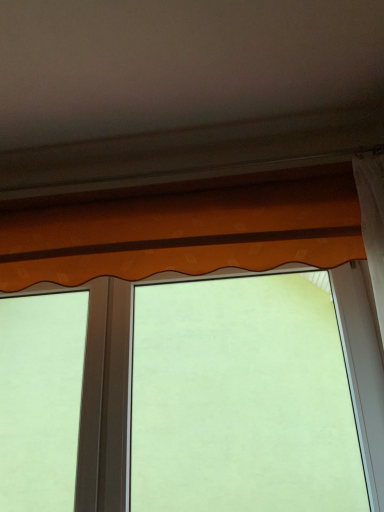
Where is `orange fabric valance at center`? The width and height of the screenshot is (384, 512). orange fabric valance at center is located at coordinates (106, 399).

Image resolution: width=384 pixels, height=512 pixels. What do you see at coordinates (106, 399) in the screenshot?
I see `orange fabric valance at center` at bounding box center [106, 399].

Where is `orange fabric curtain at upper center`? The image size is (384, 512). orange fabric curtain at upper center is located at coordinates (185, 232).

This screenshot has height=512, width=384. Describe the element at coordinates (185, 232) in the screenshot. I see `orange fabric curtain at upper center` at that location.

Find the location of `orange fabric valance at center`. orange fabric valance at center is located at coordinates (106, 399).

Considering the positions of objects orange fabric curtain at upper center and orange fabric valance at center in the image provided, who is more to the left, orange fabric curtain at upper center or orange fabric valance at center?

orange fabric valance at center is more to the left.

Is orange fabric curtain at upper center positioned in front of orange fabric valance at center?

Yes, the depth of orange fabric curtain at upper center is less than that of orange fabric valance at center.

Which is in front, point (184, 271) or point (365, 437)?

Point (184, 271)

From the image's perspective, is orange fabric curtain at upper center above or below orange fabric valance at center?

Based on their image positions, orange fabric curtain at upper center is located above orange fabric valance at center.

From a real-world perspective, is orange fabric curtain at upper center positioned above or below orange fabric valance at center?

orange fabric curtain at upper center is above orange fabric valance at center.

Which of these two, orange fabric curtain at upper center or orange fabric valance at center, is thinner?

With smaller width is orange fabric valance at center.

Between orange fabric curtain at upper center and orange fabric valance at center, which one has less height?

Standing shorter between the two is orange fabric curtain at upper center.

Who is bigger, orange fabric curtain at upper center or orange fabric valance at center?

orange fabric valance at center is bigger.

Is orange fabric curtain at upper center not within orange fabric valance at center?

Yes, orange fabric curtain at upper center is located beyond the bounds of orange fabric valance at center.

Is orange fabric curtain at upper center positioned far away from orange fabric valance at center?

orange fabric curtain at upper center is actually quite close to orange fabric valance at center.

Could you tell me if orange fabric curtain at upper center is facing orange fabric valance at center?

No, orange fabric curtain at upper center is not oriented towards orange fabric valance at center.

Measure the distance from orange fabric curtain at upper center to orange fabric valance at center.

orange fabric curtain at upper center is 44.84 centimeters away from orange fabric valance at center.

Where is `curtain above the orange fabric valance at center (from a real-world perspective)`? Image resolution: width=384 pixels, height=512 pixels. curtain above the orange fabric valance at center (from a real-world perspective) is located at coordinates (185, 232).

Which object is positioned more to the left, orange fabric valance at center or orange fabric curtain at upper center?

From the viewer's perspective, orange fabric valance at center appears more on the left side.

In the image, is orange fabric valance at center positioned in front of or behind orange fabric curtain at upper center?

Clearly, orange fabric valance at center is behind orange fabric curtain at upper center.

Does point (367, 348) come in front of point (337, 175)?

Yes, point (367, 348) is closer to viewer.

From the image's perspective, is orange fabric valance at center on top of orange fabric curtain at upper center?

Incorrect, from the image's perspective, orange fabric valance at center is lower than orange fabric curtain at upper center.

From a real-world perspective, is orange fabric valance at center above or below orange fabric curtain at upper center?

Clearly, from a real-world perspective, orange fabric valance at center is below orange fabric curtain at upper center.

Between orange fabric valance at center and orange fabric curtain at upper center, which one has larger width?

With larger width is orange fabric curtain at upper center.

In terms of height, does orange fabric valance at center look taller or shorter compared to orange fabric curtain at upper center?

Considering their sizes, orange fabric valance at center has more height than orange fabric curtain at upper center.

Who is smaller, orange fabric valance at center or orange fabric curtain at upper center?

orange fabric curtain at upper center.

Is orange fabric curtain at upper center located within orange fabric valance at center?

No, orange fabric valance at center does not contain orange fabric curtain at upper center.

Consider the image. Can you see orange fabric valance at center touching orange fabric curtain at upper center?

No, orange fabric valance at center is not in contact with orange fabric curtain at upper center.

Is orange fabric valance at center oriented towards orange fabric curtain at upper center?

Yes, orange fabric valance at center is aimed at orange fabric curtain at upper center.

Measure the distance from orange fabric valance at center to orange fabric curtain at upper center.

A distance of 17.65 inches exists between orange fabric valance at center and orange fabric curtain at upper center.

Locate an element on the screen. curtain above the orange fabric valance at center (from a real-world perspective) is located at coordinates (185, 232).

This screenshot has width=384, height=512. I want to click on curtain to the right of orange fabric valance at center, so click(185, 232).

At what (x,y) coordinates should I click in order to perform the action: click on window below the orange fabric curtain at upper center (from the image's perspective). Please return your answer as a coordinate pair (x, y). The image size is (384, 512). Looking at the image, I should click on (106, 399).